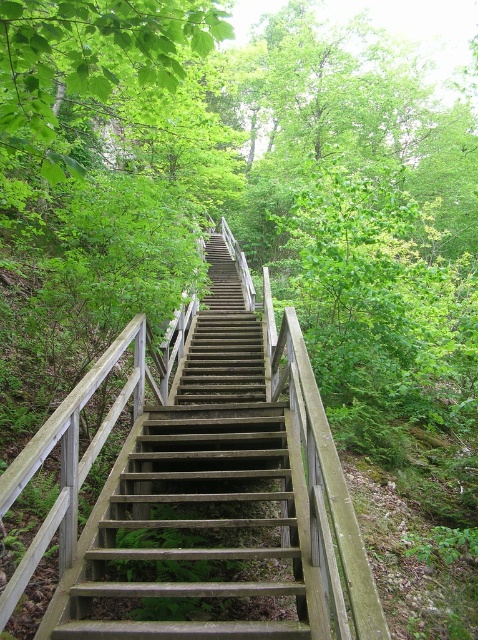
In the scene shown: You are hiking up a trail and see the wooden stairs at center and the green leafy tree at upper left. Which object appears smaller in the image?

The wooden stairs at center appears smaller than the green leafy tree at upper left in the image.

You are a hiker carrying a 6 feet long hiking pole. You want to place the pole horizontally between the wooden stairs at center and the green leafy tree at upper left. Will the pole fit without bending or breaking?

The wooden stairs at center is 11.54 feet from the green leafy tree at upper left. Since the pole is 6 feet long, it will fit comfortably between them without needing to bend or break.

You are standing at the base of the wooden stairs at center and want to reach the green leafy tree at upper left. Which object is closer to you?

The wooden stairs at center is closer to you than the green leafy tree at upper left.